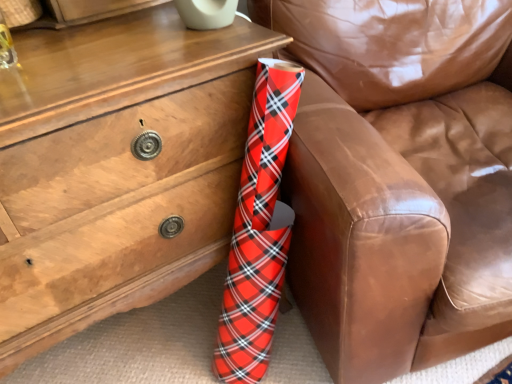
The image size is (512, 384). Identify the location of red plaid wrapping paper at lower left. (399, 179).

Measure the distance between red plaid wrapping paper at lower left and camera.

red plaid wrapping paper at lower left is 24.86 inches from camera.

The height and width of the screenshot is (384, 512). Describe the element at coordinates (399, 179) in the screenshot. I see `red plaid wrapping paper at lower left` at that location.

What is the approximate height of red plaid wrapping paper at lower left?

red plaid wrapping paper at lower left is 35.01 inches in height.

What is the approximate height of matte wood chest of drawers at lower left?

matte wood chest of drawers at lower left is 31.10 inches tall.

Describe the element at coordinates (116, 167) in the screenshot. I see `matte wood chest of drawers at lower left` at that location.

Identify the location of matte wood chest of drawers at lower left. (116, 167).

Where is `red plaid wrapping paper at lower left`? The height and width of the screenshot is (384, 512). red plaid wrapping paper at lower left is located at coordinates (399, 179).

Considering the positions of objects matte wood chest of drawers at lower left and red plaid wrapping paper at lower left in the image provided, who is more to the left, matte wood chest of drawers at lower left or red plaid wrapping paper at lower left?

From the viewer's perspective, matte wood chest of drawers at lower left appears more on the left side.

Which is in front, matte wood chest of drawers at lower left or red plaid wrapping paper at lower left?

red plaid wrapping paper at lower left is closer to the camera.

Is point (152, 203) closer to viewer compared to point (381, 279)?

No.

From the image's perspective, between matte wood chest of drawers at lower left and red plaid wrapping paper at lower left, which one is located above?

red plaid wrapping paper at lower left, from the image's perspective.

From a real-world perspective, which object stands above the other?

In real-world perspective, red plaid wrapping paper at lower left is above.

Is matte wood chest of drawers at lower left wider than red plaid wrapping paper at lower left?

No, matte wood chest of drawers at lower left is not wider than red plaid wrapping paper at lower left.

Considering the relative sizes of matte wood chest of drawers at lower left and red plaid wrapping paper at lower left in the image provided, is matte wood chest of drawers at lower left shorter than red plaid wrapping paper at lower left?

Indeed, matte wood chest of drawers at lower left has a lesser height compared to red plaid wrapping paper at lower left.

Which of these two, matte wood chest of drawers at lower left or red plaid wrapping paper at lower left, is bigger?

With larger size is red plaid wrapping paper at lower left.

Is matte wood chest of drawers at lower left outside of red plaid wrapping paper at lower left?

Yes, matte wood chest of drawers at lower left is outside of red plaid wrapping paper at lower left.

Is matte wood chest of drawers at lower left positioned far away from red plaid wrapping paper at lower left?

That's not correct — matte wood chest of drawers at lower left is a little close to red plaid wrapping paper at lower left.

Looking at this image, is matte wood chest of drawers at lower left facing towards red plaid wrapping paper at lower left?

No, matte wood chest of drawers at lower left is not aimed at red plaid wrapping paper at lower left.

How many degrees apart are the facing directions of matte wood chest of drawers at lower left and red plaid wrapping paper at lower left?

There is a 17.2-degree angle between the facing directions of matte wood chest of drawers at lower left and red plaid wrapping paper at lower left.

Measure the distance from matte wood chest of drawers at lower left to red plaid wrapping paper at lower left.

They are 14.43 inches apart.

Identify the location of furniture on the right of matte wood chest of drawers at lower left. The height and width of the screenshot is (384, 512). (399, 179).

Based on their positions, is red plaid wrapping paper at lower left located to the left or right of matte wood chest of drawers at lower left?

red plaid wrapping paper at lower left is positioned on matte wood chest of drawers at lower left's right side.

Is the depth of red plaid wrapping paper at lower left greater than that of matte wood chest of drawers at lower left?

No, red plaid wrapping paper at lower left is closer to the viewer.

Is point (502, 108) positioned in front of point (125, 278)?

That is False.

From the image's perspective, which one is positioned lower, red plaid wrapping paper at lower left or matte wood chest of drawers at lower left?

matte wood chest of drawers at lower left appears lower in the image.

From a real-world perspective, is red plaid wrapping paper at lower left beneath matte wood chest of drawers at lower left?

No, from a real-world perspective, red plaid wrapping paper at lower left is not under matte wood chest of drawers at lower left.

Which object is wider, red plaid wrapping paper at lower left or matte wood chest of drawers at lower left?

With larger width is red plaid wrapping paper at lower left.

Does red plaid wrapping paper at lower left have a greater height compared to matte wood chest of drawers at lower left?

Yes, red plaid wrapping paper at lower left is taller than matte wood chest of drawers at lower left.

Can you confirm if red plaid wrapping paper at lower left is bigger than matte wood chest of drawers at lower left?

Yes, red plaid wrapping paper at lower left is bigger than matte wood chest of drawers at lower left.

Is matte wood chest of drawers at lower left located within red plaid wrapping paper at lower left?

No, matte wood chest of drawers at lower left is not a part of red plaid wrapping paper at lower left.

Would you say red plaid wrapping paper at lower left is a long distance from matte wood chest of drawers at lower left?

red plaid wrapping paper at lower left is actually quite close to matte wood chest of drawers at lower left.

Is red plaid wrapping paper at lower left aimed at matte wood chest of drawers at lower left?

No, red plaid wrapping paper at lower left is not aimed at matte wood chest of drawers at lower left.

How different are the orientations of red plaid wrapping paper at lower left and matte wood chest of drawers at lower left in degrees?

17.2 degrees.

This screenshot has height=384, width=512. I want to click on chest of drawers behind the red plaid wrapping paper at lower left, so click(x=116, y=167).

This screenshot has height=384, width=512. Find the location of `furniture on the right of matte wood chest of drawers at lower left`. furniture on the right of matte wood chest of drawers at lower left is located at coordinates (399, 179).

This screenshot has width=512, height=384. There is a matte wood chest of drawers at lower left. Find the location of `furniture above it (from a real-world perspective)`. furniture above it (from a real-world perspective) is located at coordinates (399, 179).